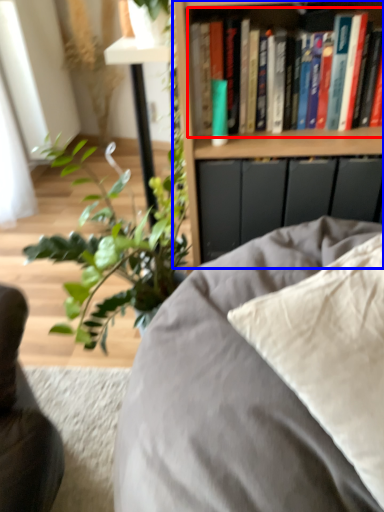
Question: Which object is further to the camera taking this photo, book (highlighted by a red box) or bookcase (highlighted by a blue box)?

Choices:
 (A) book
 (B) bookcase

Answer: (A)